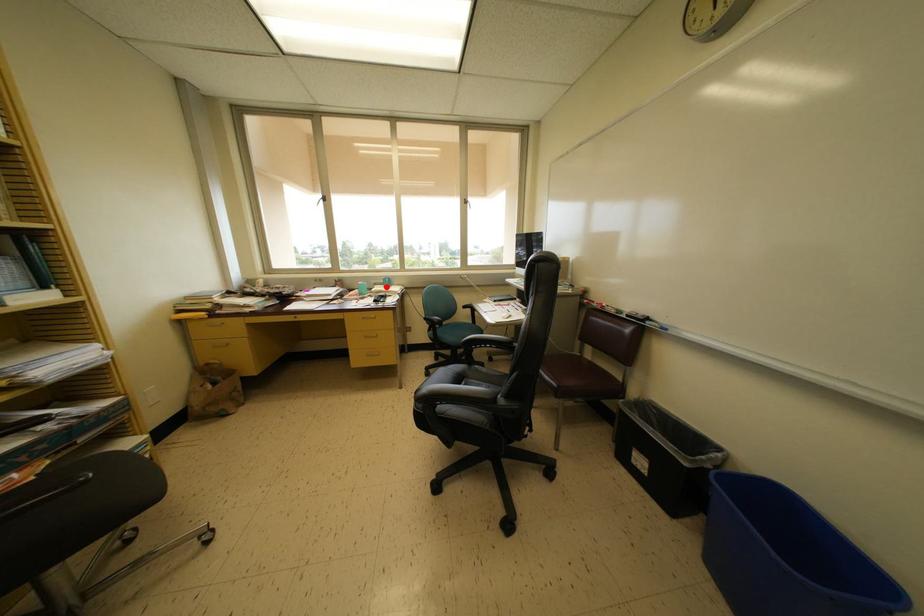
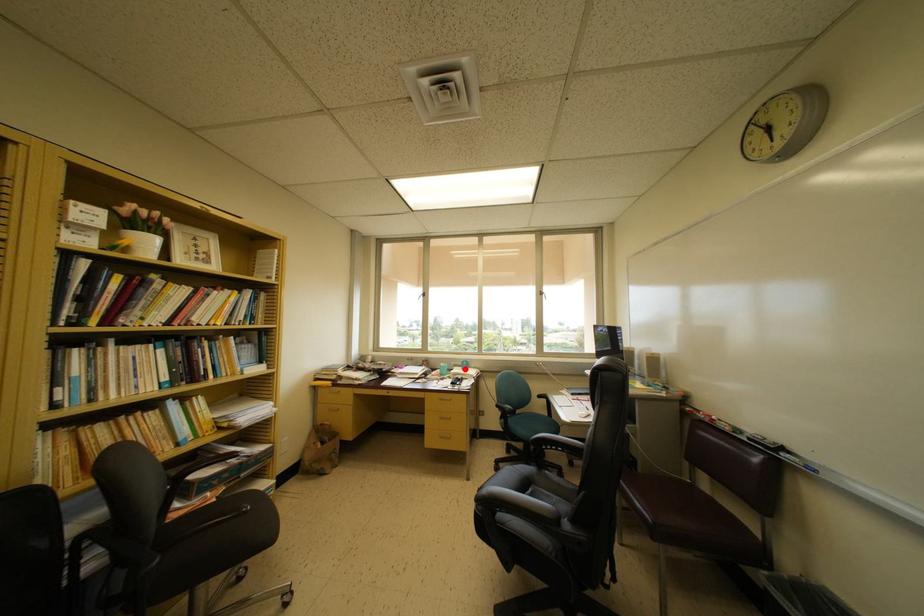
I am providing you with two images of the same scene from different viewpoints. A red point is marked on the first image and another point is marked on the second image. Does the point marked in image1 correspond to the same location as the one in image2?

Yes